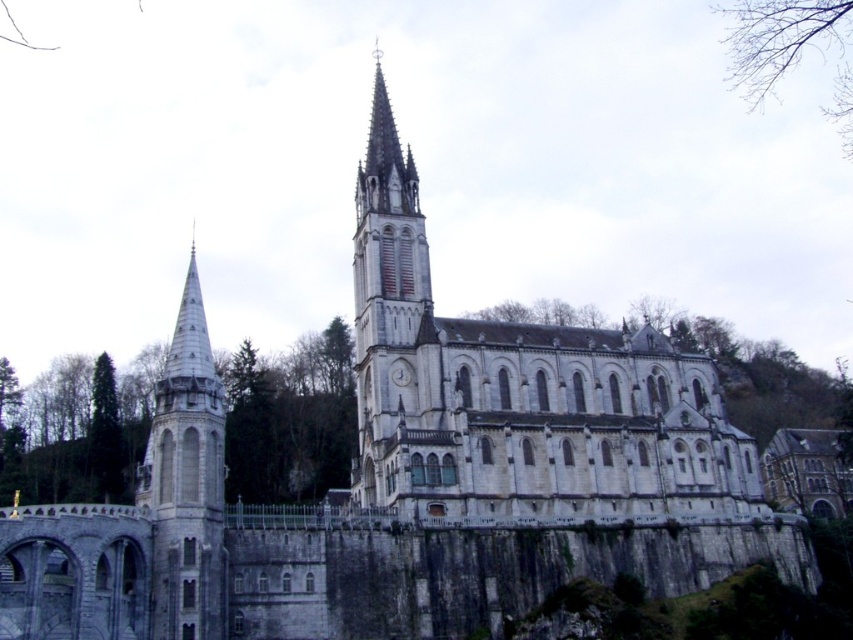
In the scene shown: Between white stone church at center and bare branches at upper right, which one appears on the right side from the viewer's perspective?

bare branches at upper right

Can you confirm if white stone church at center is positioned above bare branches at upper right?

No.

What do you see at coordinates (519, 392) in the screenshot? I see `white stone church at center` at bounding box center [519, 392].

You are a GUI agent. You are given a task and a screenshot of the screen. Output one action in this format:
    pyautogui.click(x=<x>, y=<y>)
    Task: Click on the white stone church at center
    Image resolution: width=853 pixels, height=640 pixels.
    Given the screenshot: What is the action you would take?
    pyautogui.click(x=519, y=392)

Who is positioned more to the left, smooth stone clock tower at center or white stone spire at left?

white stone spire at left

Locate an element on the screen. The height and width of the screenshot is (640, 853). smooth stone clock tower at center is located at coordinates (393, 323).

Can you confirm if smooth stone clock tower at center is smaller than bare branches at upper right?

Actually, smooth stone clock tower at center might be larger than bare branches at upper right.

This screenshot has width=853, height=640. What are the coordinates of `smooth stone clock tower at center` in the screenshot? It's located at (393, 323).